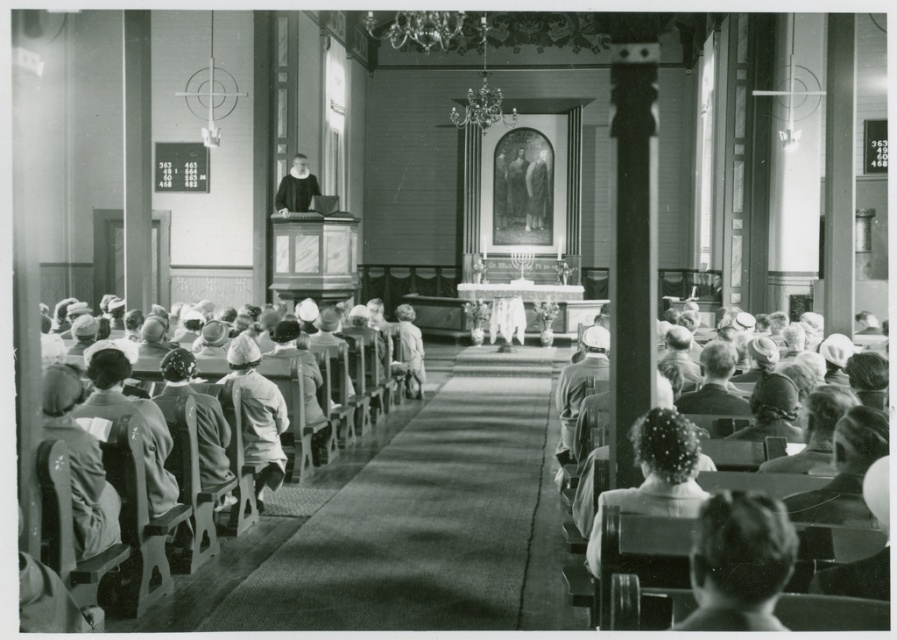
Question: Can you confirm if short hair at lower right is smaller than smooth wooden statue at center?

Choices:
 (A) yes
 (B) no

Answer: (A)

Question: Which of the following is the closest to the observer?

Choices:
 (A) short hair at lower right
 (B) light brown hair at lower right
 (C) white fabric dress at left
 (D) smooth wooden statue at center

Answer: (A)

Question: Estimate the real-world distances between objects in this image. Which object is closer to the light brown hair at lower right?

Choices:
 (A) short hair at lower right
 (B) white fabric dress at left

Answer: (A)

Question: Can you confirm if white fabric dress at left is wider than smooth black robe at center?

Choices:
 (A) yes
 (B) no

Answer: (B)

Question: Is light brown hair at lower right to the left of white fabric dress at left from the viewer's perspective?

Choices:
 (A) no
 (B) yes

Answer: (A)

Question: Among these objects, which one is nearest to the camera?

Choices:
 (A) light brown hair at lower right
 (B) short hair at lower right

Answer: (B)